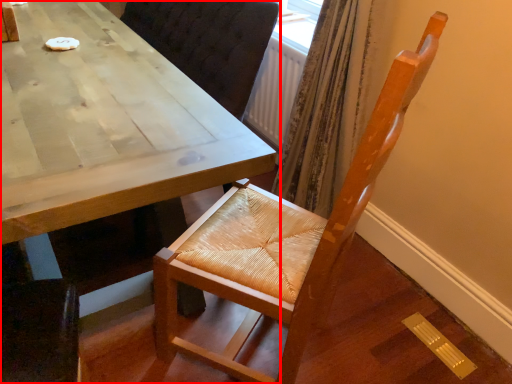
Question: Considering the relative positions of table (annotated by the red box) and chair in the image provided, where is table (annotated by the red box) located with respect to the staircase?

Choices:
 (A) right
 (B) left

Answer: (B)